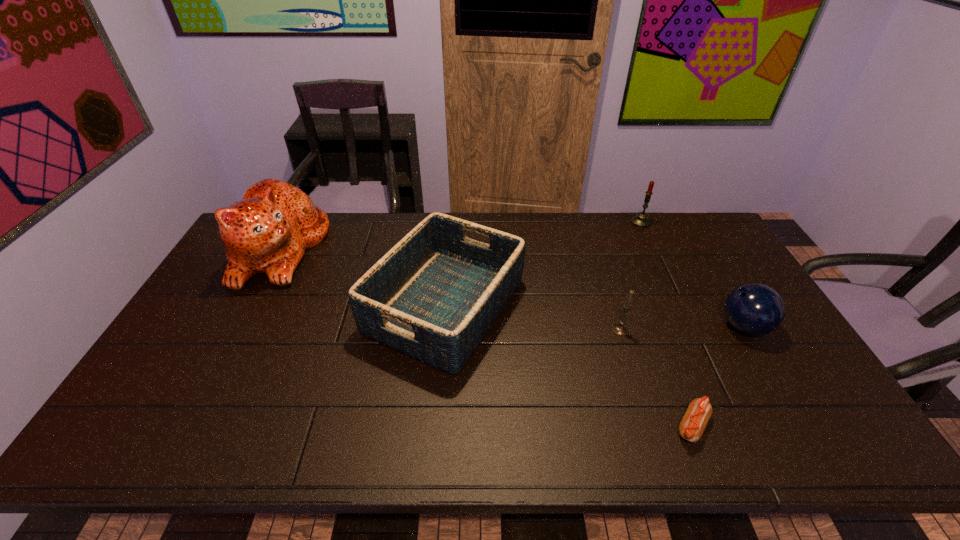
Locate an element on the screen. This screenshot has height=540, width=960. free space at the near right corner is located at coordinates (792, 454).

Where is `vacant space that is in between the sausage and the right candle`? This screenshot has width=960, height=540. vacant space that is in between the sausage and the right candle is located at coordinates (666, 325).

This screenshot has width=960, height=540. I want to click on free space that is in between the nearer candle and the second object from right to left, so click(631, 276).

Identify the location of vacant area that lies between the left candle and the fifth object from left to right. The height and width of the screenshot is (540, 960). [631, 276].

Identify the location of vacant area between the basket and the rightmost object. Image resolution: width=960 pixels, height=540 pixels. (594, 316).

Locate an element on the screen. This screenshot has width=960, height=540. empty space that is in between the bowling ball and the shortest object is located at coordinates (718, 376).

Identify the location of empty location between the basket and the nearer candle. (533, 318).

Locate which object is the second closest to the fourth object from right to left. Please provide its 2D coordinates. Your answer should be formatted as a tuple, i.e. [(x, y)], where the tuple contains the x and y coordinates of a point satisfying the conditions above.

[(434, 296)]

Where is `object that is the fifth closest one to the farther candle`? object that is the fifth closest one to the farther candle is located at coordinates (267, 232).

Image resolution: width=960 pixels, height=540 pixels. I want to click on vacant area in the image that satisfies the following two spatial constraints: 1. on the face of the basket; 2. on the right side of the leftmost object, so click(250, 306).